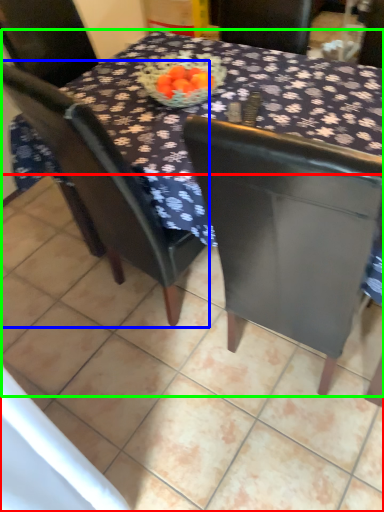
Question: Which is nearer to the tile (highlighted by a red box)? chair (highlighted by a blue box) or table (highlighted by a green box).

Choices:
 (A) chair
 (B) table

Answer: (A)